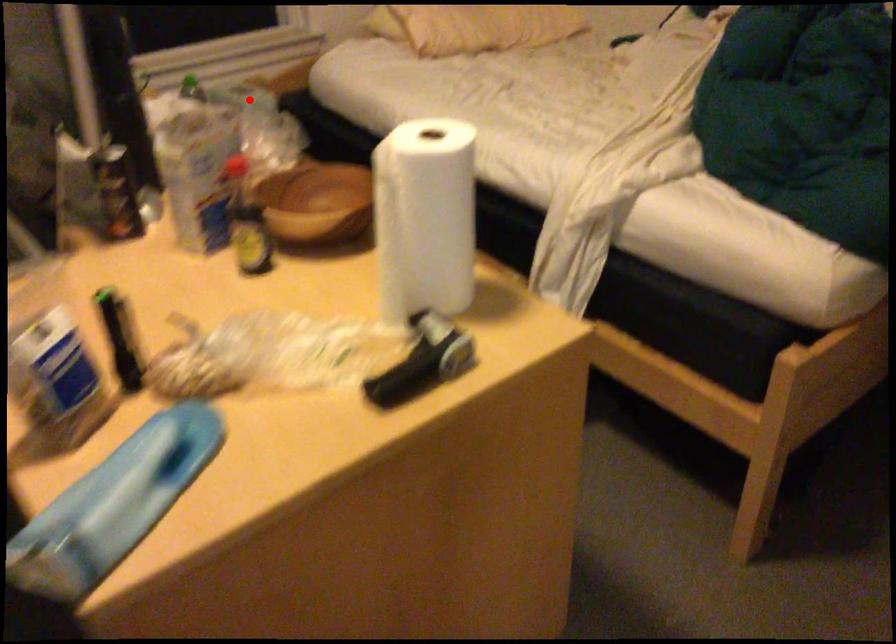
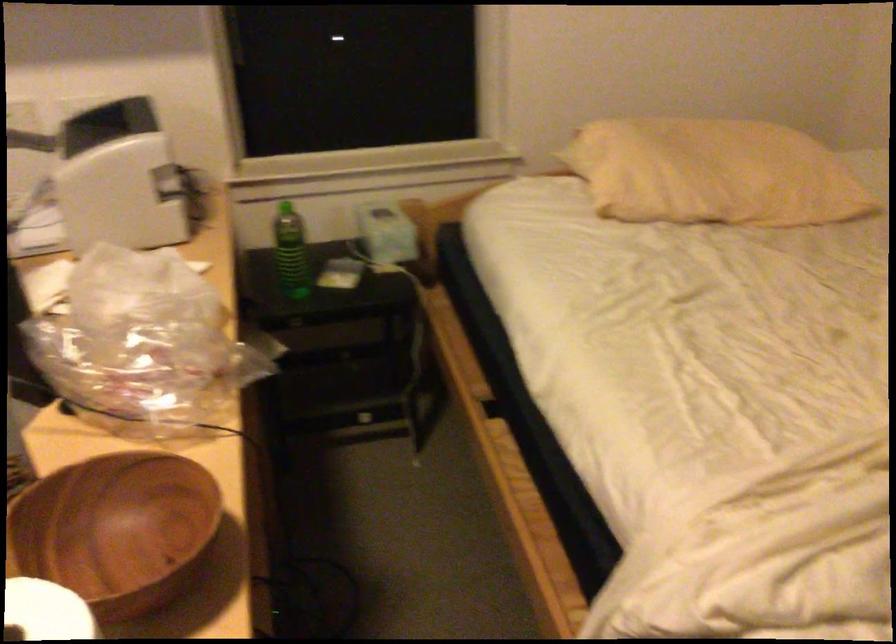
Question: I am providing you with two images of the same scene from different viewpoints. In image1, a red point is highlighted. Considering the same 3D point in image2, which of the following is correct?

Choices:
 (A) It is closer
 (B) It is farther

Answer: (A)